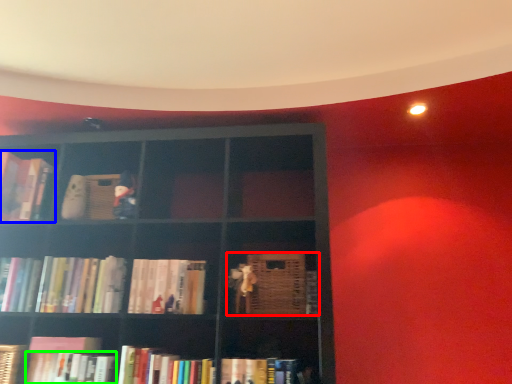
Question: Based on their relative distances, which object is farther from book (highlighted by a red box)? Choose from book (highlighted by a blue box) and book (highlighted by a green box).

Choices:
 (A) book
 (B) book

Answer: (A)